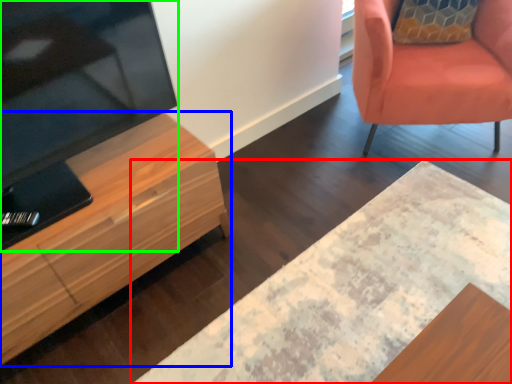
Question: Which is nearer to the desk (highlighted by a red box)? cabinetry (highlighted by a blue box) or television (highlighted by a green box).

Choices:
 (A) cabinetry
 (B) television

Answer: (A)